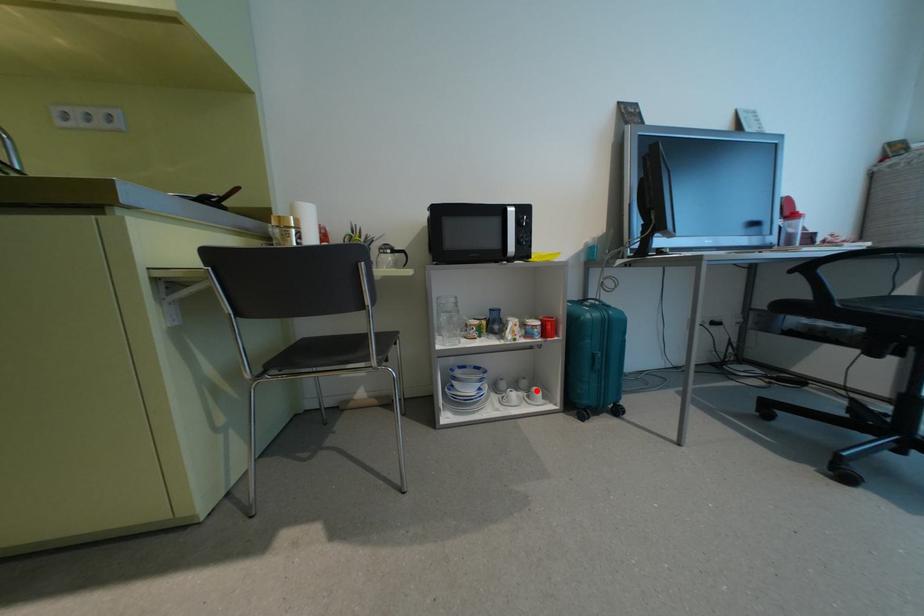
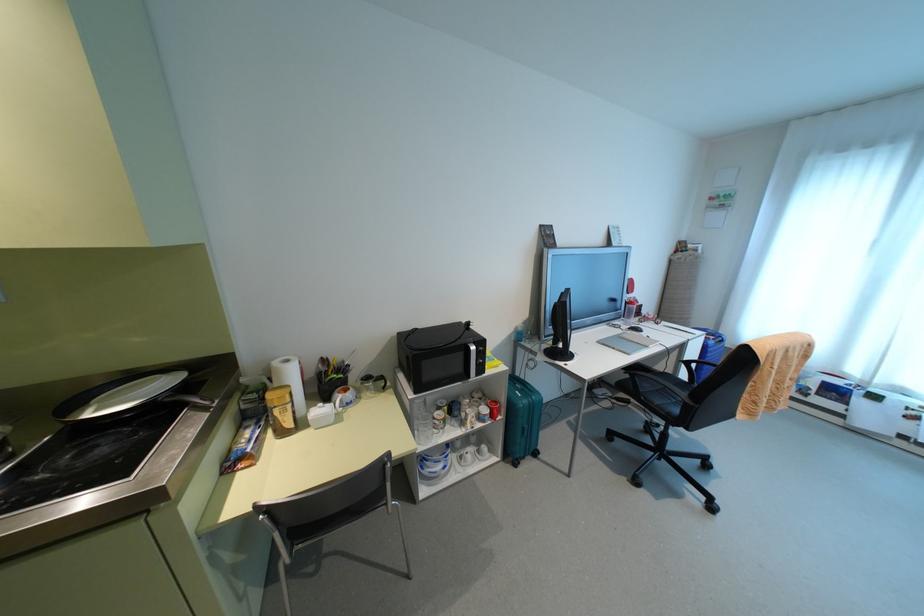
Question: A red point is marked in image1. In image2, is the corresponding 3D point closer to the camera or farther? Reply with the corresponding letter.

Choices:
 (A) The corresponding 3D point is closer.
 (B) The corresponding 3D point is farther.

Answer: (B)